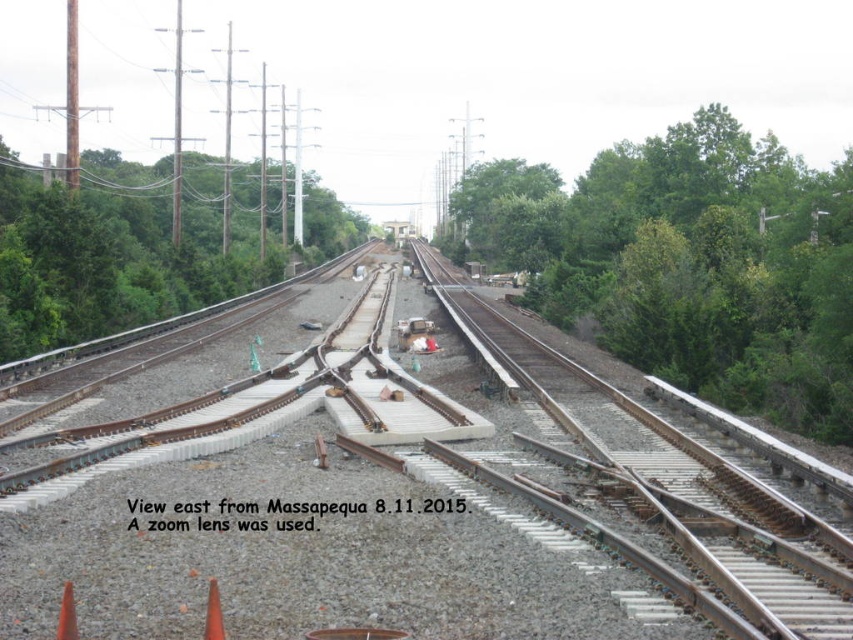
You are standing at the center of the image and see the rusty metal train track at center and the green leafy tree at center. Which object is more to the left?

The rusty metal train track at center is positioned on the left side of green leafy tree at center, so it is more to the left.